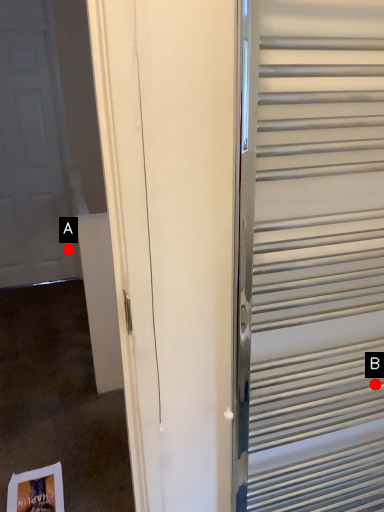
Question: Two points are circled on the image, labeled by A and B beside each circle. Which point is closer to the camera?

Choices:
 (A) A is closer
 (B) B is closer

Answer: (B)